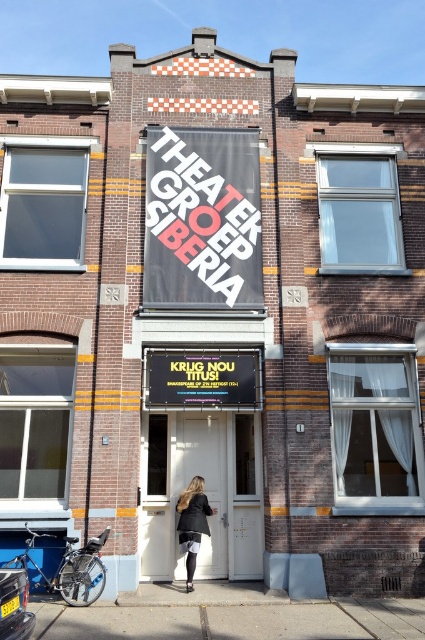
Question: Among these objects, which one is farthest from the camera?

Choices:
 (A) gray concrete pavement at lower center
 (B) black matte signboard at center
 (C) black fabric sign at center

Answer: (C)

Question: Which is farther from the matte black coat at center?

Choices:
 (A) black fabric sign at center
 (B) black matte sign at center

Answer: (A)

Question: Among these points, which one is farthest from the camera?

Choices:
 (A) (408, 604)
 (B) (229, 218)
 (C) (192, 547)

Answer: (B)

Question: Can you confirm if black matte signboard at center is positioned above gray concrete pavement at lower center?

Choices:
 (A) yes
 (B) no

Answer: (A)

Question: Is black matte signboard at center above black fabric sign at center?

Choices:
 (A) yes
 (B) no

Answer: (B)

Question: Is black matte signboard at center thinner than black fabric sign at center?

Choices:
 (A) no
 (B) yes

Answer: (B)